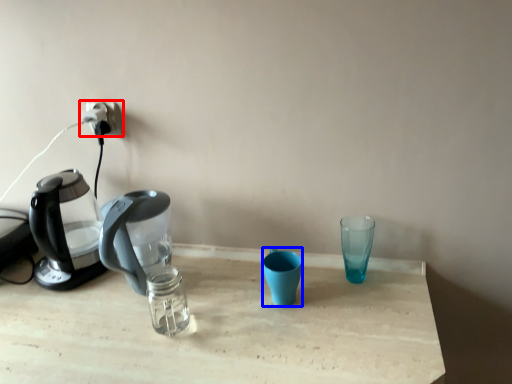
Question: Which of the following is the farthest to the observer, power plugs and sockets (highlighted by a red box) or coffee cup (highlighted by a blue box)?

Choices:
 (A) power plugs and sockets
 (B) coffee cup

Answer: (A)